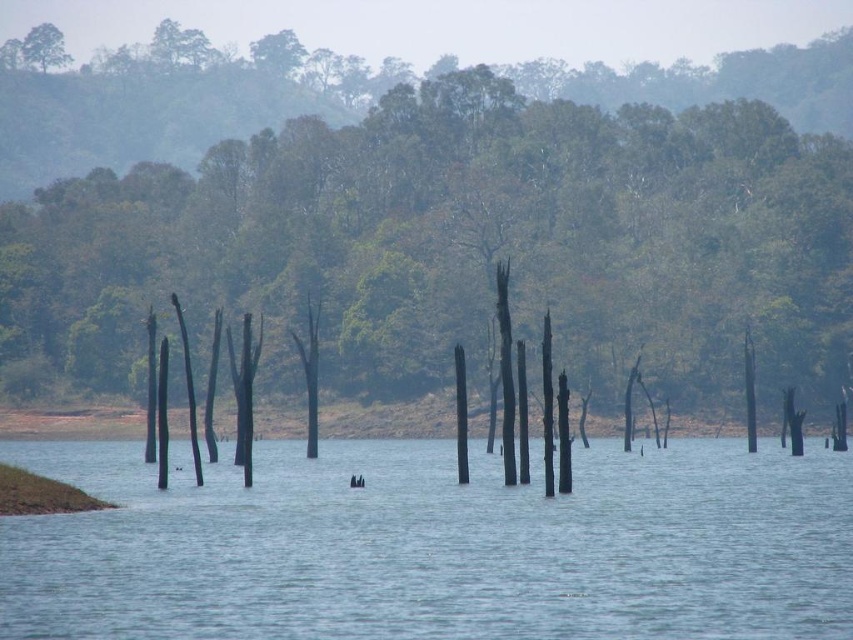
Is brown wood tree at center wider than green matte tree at upper left?

Yes.

In the scene shown: Can you confirm if brown wood tree at center is shorter than green matte tree at upper left?

No, brown wood tree at center is not shorter than green matte tree at upper left.

Which is behind, point (320, 234) or point (57, 52)?

Positioned behind is point (57, 52).

Identify the location of brown wood tree at center. (444, 225).

Looking at this image, who is more forward, (227, 484) or (25, 54)?

Point (227, 484) is in front.

Image resolution: width=853 pixels, height=640 pixels. Find the location of `blue water at center`. blue water at center is located at coordinates (434, 545).

Does brown wood tree at center appear on the right side of blue water at center?

Correct, you'll find brown wood tree at center to the right of blue water at center.

Which is above, brown wood tree at center or blue water at center?

brown wood tree at center is above.

Where is `brown wood tree at center`? The width and height of the screenshot is (853, 640). brown wood tree at center is located at coordinates point(444,225).

Where is `brown wood tree at center`? This screenshot has height=640, width=853. brown wood tree at center is located at coordinates (444, 225).